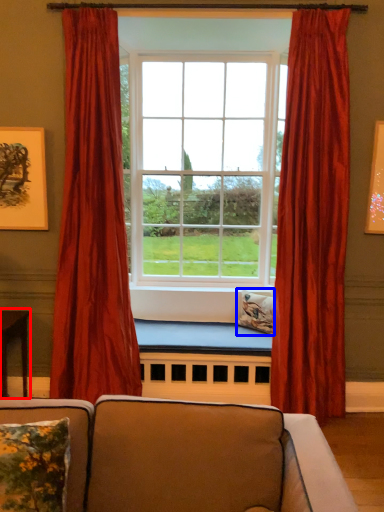
Question: Which object appears closest to the camera in this image, table (highlighted by a red box) or pillow (highlighted by a blue box)?

Choices:
 (A) table
 (B) pillow

Answer: (A)